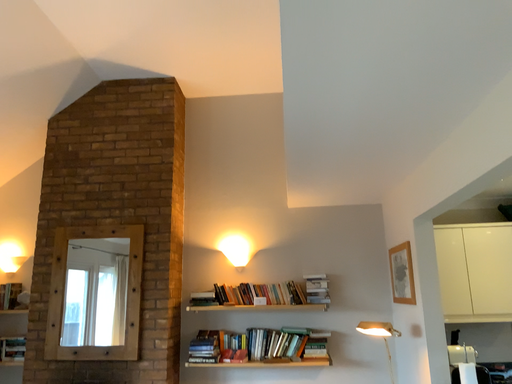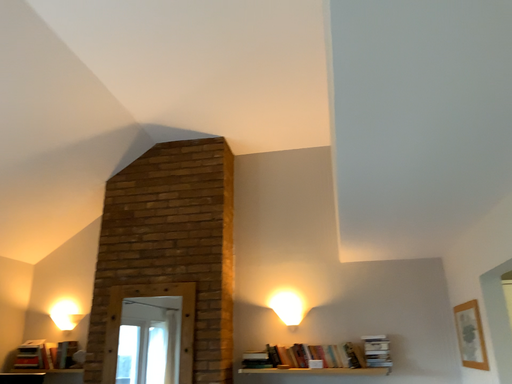
Question: How did the camera likely rotate when shooting the video?

Choices:
 (A) rotated upward
 (B) rotated downward

Answer: (A)